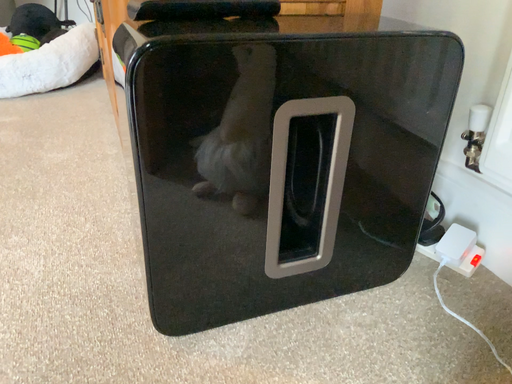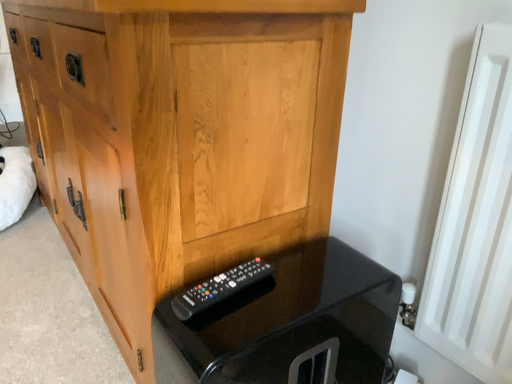
Question: How did the camera likely rotate when shooting the video?

Choices:
 (A) rotated left
 (B) rotated right

Answer: (B)